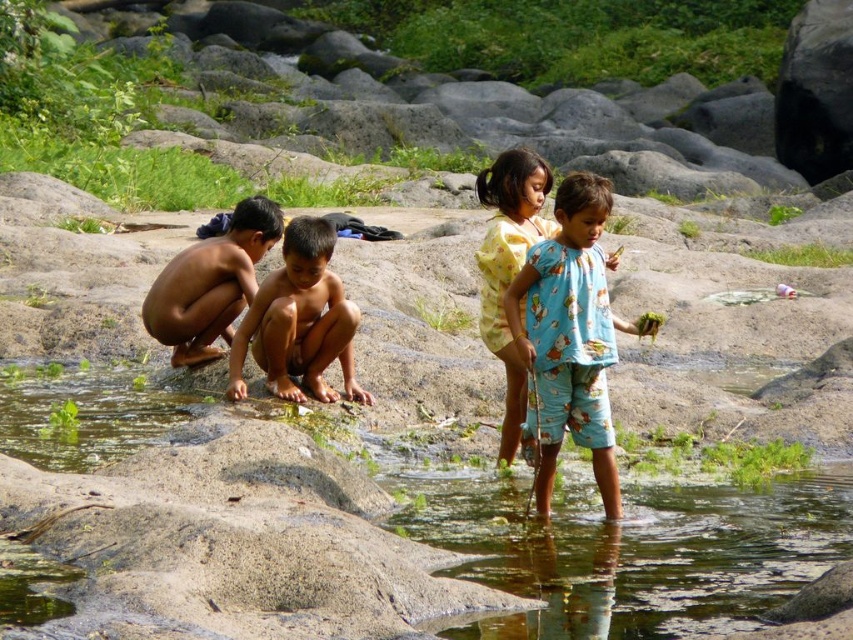
Who is positioned more to the right, blue cotton pajamas at center or brown skin boy at center?

Positioned to the right is blue cotton pajamas at center.

Image resolution: width=853 pixels, height=640 pixels. What do you see at coordinates (569, 339) in the screenshot?
I see `blue cotton pajamas at center` at bounding box center [569, 339].

Locate an element on the screen. The width and height of the screenshot is (853, 640). blue cotton pajamas at center is located at coordinates (569, 339).

Does clear water at stream center have a greater height compared to clear water at lower center?

No.

Does clear water at stream center come in front of clear water at lower center?

No.

Is point (28, 595) farther from camera compared to point (749, 528)?

No, it is not.

You are a GUI agent. You are given a task and a screenshot of the screen. Output one action in this format:
    pyautogui.click(x=<x>, y=<y>)
    Task: Click on the clear water at stream center
    The image size is (853, 640).
    Given the screenshot: What is the action you would take?
    pyautogui.click(x=624, y=545)

Is clear water at stream center positioned behind brown skin boy at center?

No.

Who is shorter, clear water at stream center or brown skin boy at center?

With less height is clear water at stream center.

Which is behind, point (496, 577) or point (294, 355)?

Point (294, 355)

Locate an element on the screen. clear water at stream center is located at coordinates (624, 545).